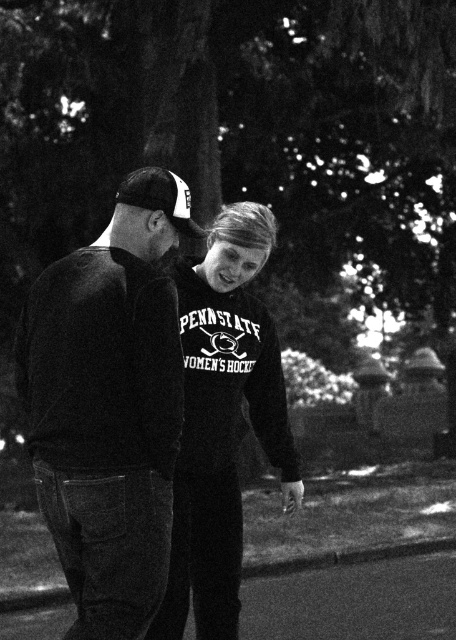
You are a photographer who needs to capture a closeup shot of the dark gray sweater at center. Your camera has a minimum focusing distance of 10 feet. Can you take the photo without moving either the camera or the sweater?

The dark gray sweater at center and camera are 10.67 feet apart, so yes, you can take the photo because the distance is within the camera s minimum focusing distance of 10 feet.

You are a fashion designer observing this nighttime scene. You notice two central items of clothing, the dark gray sweater at center and the velvet black sweatshirt at center. Which piece of clothing is positioned higher on the body?

The dark gray sweater at center is positioned higher on the body as it is above the velvet black sweatshirt at center.

You are organizing a clothing donation drive and need to determine if the dark gray sweater at center and the velvet black sweatshirt at center can fit into a standard donation box that measures 12 inches in width. Based on their sizes, will both items fit?

The dark gray sweater at center has a smaller size compared to velvet black sweatshirt at center. However, without specific measurements for each item, it is uncertain if both will fit into the 12 inch width donation box. More information is needed about their exact dimensions.